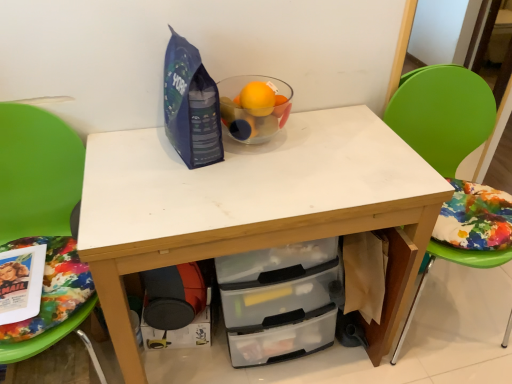
Locate an element on the screen. vacant space to the right of transparent glass bowl at center is located at coordinates (323, 139).